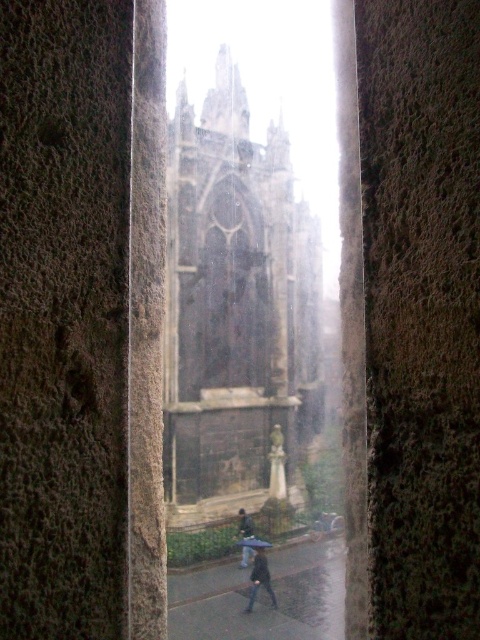
Consider the image. Is dark stone church at center shorter than transparent plastic umbrella at center?

No, dark stone church at center is not shorter than transparent plastic umbrella at center.

Between point (179, 497) and point (264, 541), which one is positioned behind?

Positioned behind is point (264, 541).

Where is `dark stone church at center`? This screenshot has width=480, height=640. dark stone church at center is located at coordinates (236, 307).

Measure the distance between dark blue jeans at center and camera.

dark blue jeans at center is 85.36 meters away from camera.

Who is more forward, (250,548) or (247,538)?

Point (250,548)

Is point (240, 564) less distant than point (265, 541)?

That is True.

The width and height of the screenshot is (480, 640). In order to click on dark blue jeans at center in this screenshot , I will do `click(244, 524)`.

Which of these two, dark stone church at center or dark gray fabric coat at center, stands shorter?

Standing shorter between the two is dark gray fabric coat at center.

Can you confirm if dark stone church at center is wider than dark gray fabric coat at center?

Yes, dark stone church at center is wider than dark gray fabric coat at center.

Is point (202, 195) closer to viewer compared to point (257, 572)?

That is False.

I want to click on dark stone church at center, so click(236, 307).